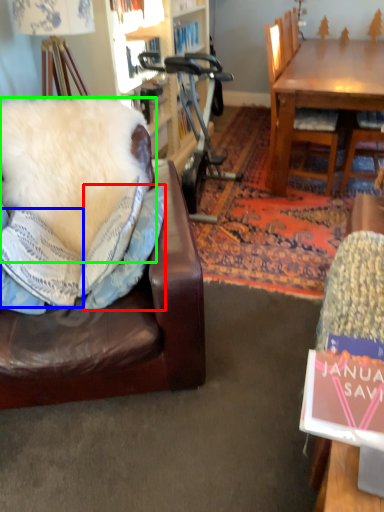
Question: Which object is positioned farthest from pillow (highlighted by a red box)? Select from pillow (highlighted by a blue box) and pillow (highlighted by a green box).

Choices:
 (A) pillow
 (B) pillow

Answer: (B)